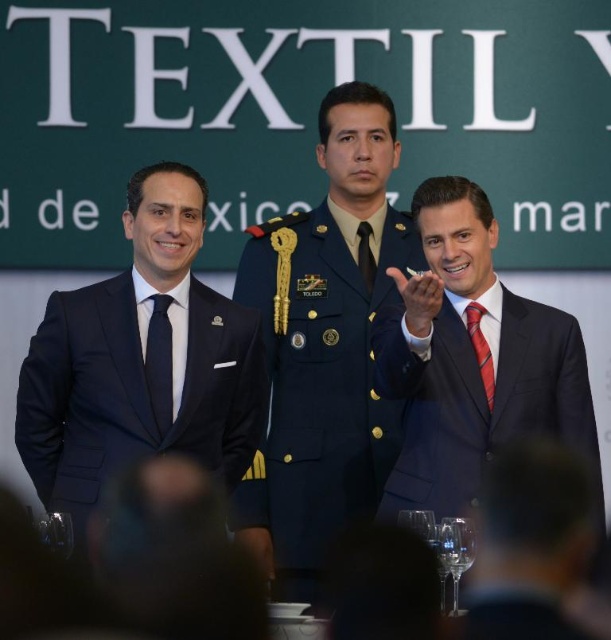
Question: Which point appears closest to the camera in this image?

Choices:
 (A) (470, 330)
 (B) (164, 348)
 (C) (56, 413)

Answer: (C)

Question: Where is red striped tie at right located in relation to matte black tie at center in the image?

Choices:
 (A) below
 (B) above

Answer: (A)

Question: Is green fabric banner at upper center to the right of matte black hand at center from the viewer's perspective?

Choices:
 (A) yes
 (B) no

Answer: (B)

Question: Among these objects, which one is farthest from the camera?

Choices:
 (A) red striped tie at right
 (B) matte black hand at center
 (C) navy blue uniform at center

Answer: (C)

Question: In this image, where is green fabric banner at upper center located relative to navy blue uniform at center?

Choices:
 (A) below
 (B) above

Answer: (B)

Question: Which object is farther from the camera taking this photo?

Choices:
 (A) matte black hand at center
 (B) shiny dark suit at right

Answer: (A)